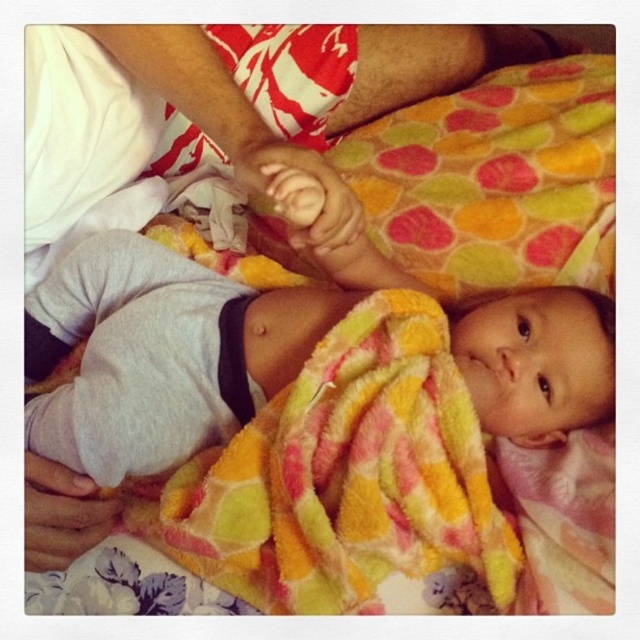
Who is higher up, multicolored fleece blanket at center or white cotton leg at upper left?

Positioned higher is white cotton leg at upper left.

Is point (348, 504) farther from camera compared to point (248, 106)?

No, it is not.

Is point (412, 300) closer to camera compared to point (337, 131)?

Yes, it is in front of point (337, 131).

Where is `multicolored fleece blanket at center`? Image resolution: width=640 pixels, height=640 pixels. multicolored fleece blanket at center is located at coordinates (342, 477).